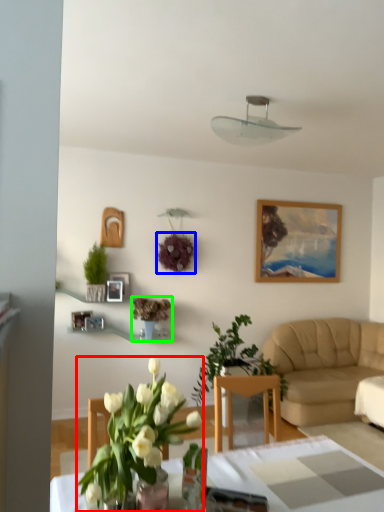
Question: Which object is positioned closest to houseplant (highlighted by a red box)? Select from flower (highlighted by a blue box) and houseplant (highlighted by a green box).

Choices:
 (A) flower
 (B) houseplant

Answer: (B)